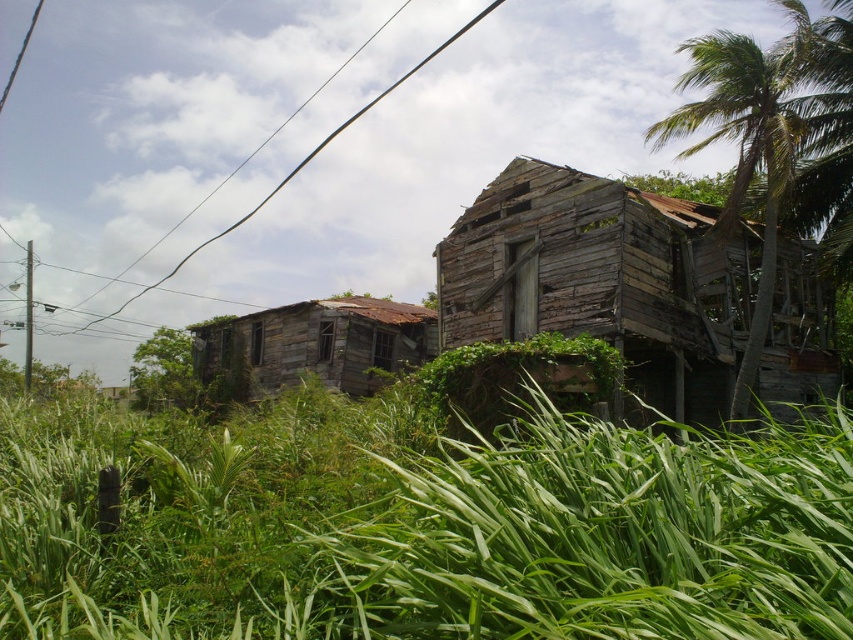
You are standing in front of the dilapidated wooden house and notice two points marked in the image. The first point is at coordinates point (758, 524) and the second is at point (788, 67). Which of these points is nearer to your current position?

Point (758, 524) is closer to the camera than point (788, 67), so the first point is nearer to your current position.

You are standing in front of the weathered wood hut at center and want to step onto the green leafy grass at lower center. Which direction should you move to reach the grass?

The green leafy grass at lower center is positioned on the left side of the weathered wood hut at center, so you should move to the left to reach the grass.